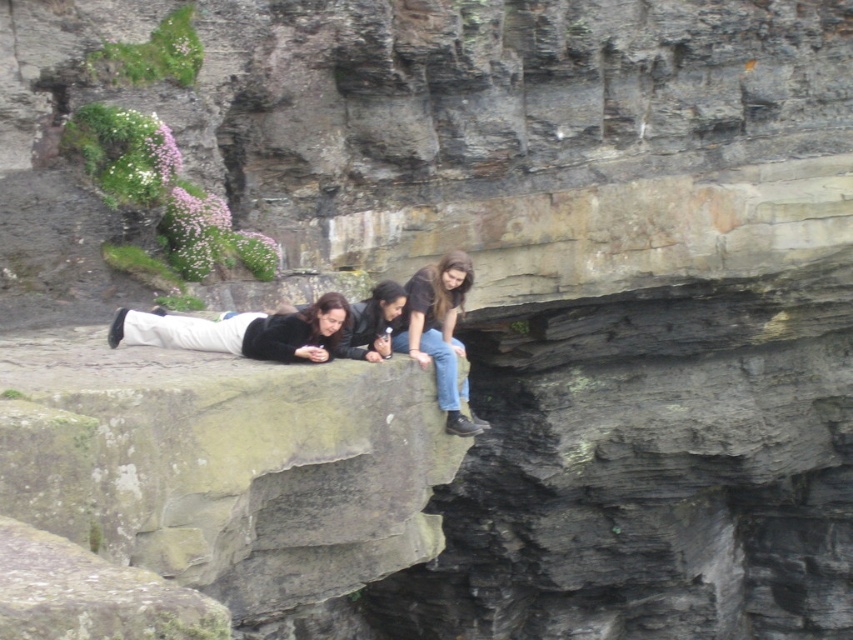
Question: Which point is farther from the camera taking this photo?

Choices:
 (A) (428, 296)
 (B) (292, 312)
 (C) (422, 342)

Answer: (A)

Question: Does matte black shirt at center appear on the left side of jeans at center?

Choices:
 (A) yes
 (B) no

Answer: (A)

Question: Which point is closer to the camera?

Choices:
 (A) (383, 298)
 (B) (457, 276)

Answer: (A)

Question: Which of the following is the closest to the observer?

Choices:
 (A) (454, 308)
 (B) (381, 291)

Answer: (B)

Question: Is jeans at center positioned behind black leather jacket at center?

Choices:
 (A) yes
 (B) no

Answer: (A)

Question: Is matte black jacket at center to the right of matte black shirt at center from the viewer's perspective?

Choices:
 (A) no
 (B) yes

Answer: (B)